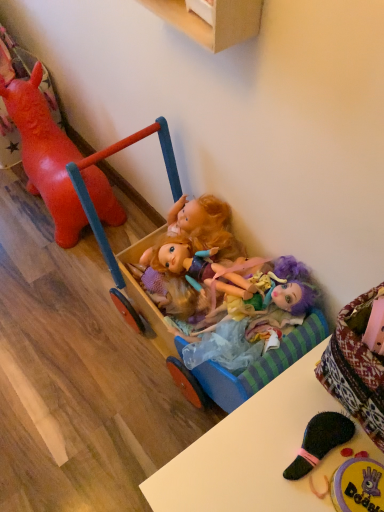
Question: Choose the correct answer: Is plush purple doll at lower right, acting as the 2th toy starting from the left, inside wooden cabinet at upper center or outside it?

Choices:
 (A) outside
 (B) inside

Answer: (A)

Question: Does point (336, 486) appear closer or farther from the camera than point (223, 17)?

Choices:
 (A) farther
 (B) closer

Answer: (B)

Question: Estimate the real-world distances between objects in this image. Which object is closer to the wooden toy carriage at center?

Choices:
 (A) wooden cabinet at upper center
 (B) glossy plastic horse at left, the second toy positioned from the right
 (C) white glossy table at lower right
 (D) multicolored fabric dolls at center
 (E) plush purple doll at lower right, placed as the first toy when sorted from right to left

Answer: (D)

Question: Considering the real-world distances, which object is farthest from the glossy plastic horse at left, placed as the 1th toy when sorted from back to front?

Choices:
 (A) multicolored fabric dolls at center
 (B) white glossy table at lower right
 (C) plush purple doll at lower right, acting as the first toy starting from the bottom
 (D) wooden cabinet at upper center
 (E) wooden toy carriage at center

Answer: (C)